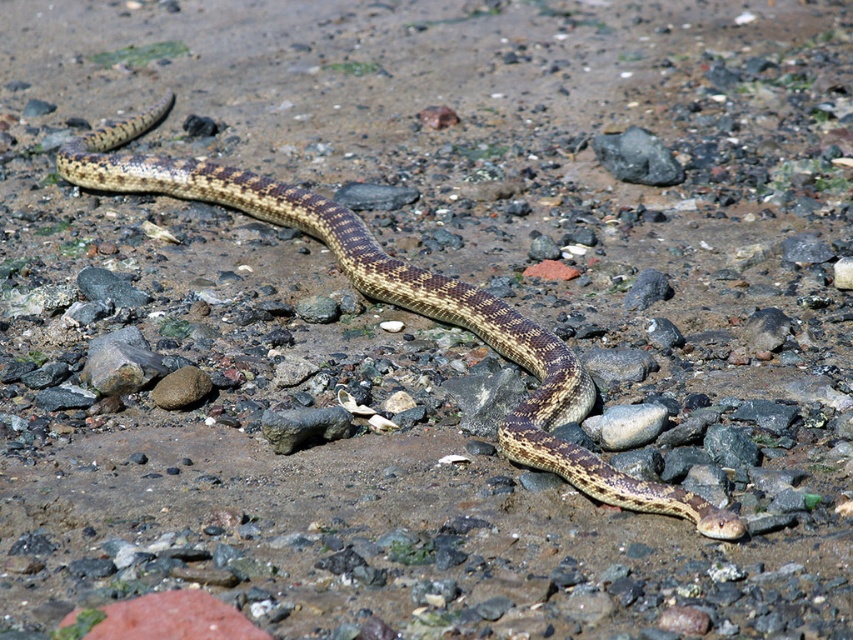
You are a geologist examining the rocky surface where the snake is moving. You notice the rough textured rock at center and the gray rock at center. Which rock would you need to exert more force to move, considering their sizes?

The rough textured rock at center has a larger size compared to gray rock at center, so you would need to exert more force to move it because larger objects generally require more effort to move.

You are a geologist examining the rocky terrain where the snake is moving. You need to determine which rock has a greater width between the rough textured rock at center and the brown rough rock at center. Based on the scene, which one is wider?

The rough textured rock at center is wider than the brown rough rock at center because the rough textured rock at center has a width that surpasses the brown rough rock at center.